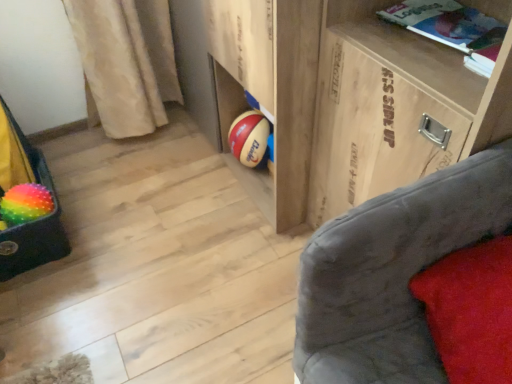
This screenshot has height=384, width=512. I want to click on empty space that is to the right of rainbow fuzzy bean bag chair at left, so click(111, 231).